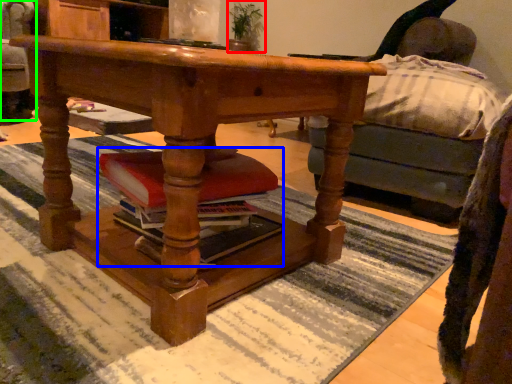
Question: Considering the real-world distances, which object is farthest from houseplant (highlighted by a red box)? book (highlighted by a blue box) or swivel chair (highlighted by a green box)?

Choices:
 (A) book
 (B) swivel chair

Answer: (A)